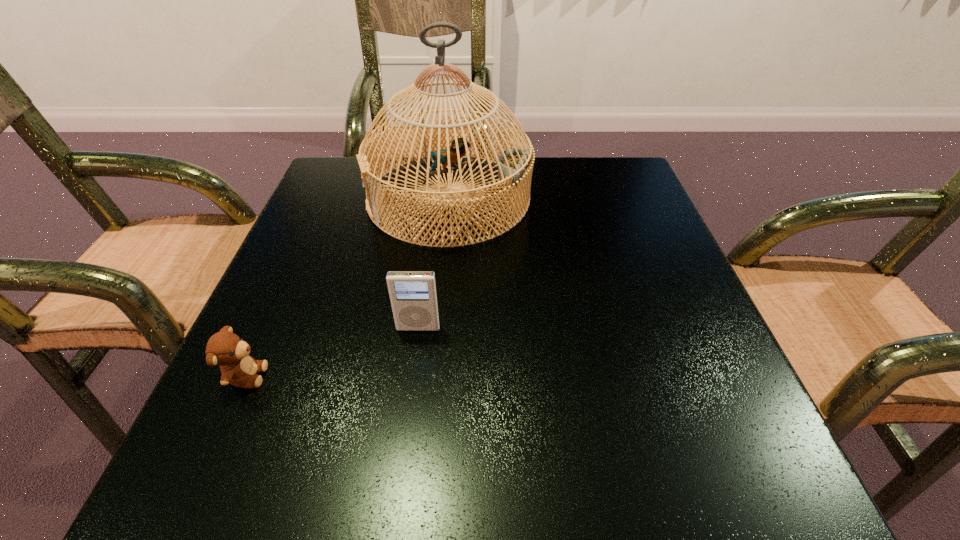
Locate an element on the screen. This screenshot has height=540, width=960. birdcage that is positioned at the left edge is located at coordinates (515, 165).

Find the location of a particular element. teddy bear positioned at the left edge is located at coordinates (229, 351).

What are the coordinates of `object present at the far left corner` in the screenshot? It's located at (515, 165).

Find the location of a particular element. free space at the far edge is located at coordinates click(x=552, y=175).

In the image, there is a desktop. Where is `vacant space at the near edge`? This screenshot has width=960, height=540. vacant space at the near edge is located at coordinates (520, 453).

The height and width of the screenshot is (540, 960). In the image, there is a desktop. Identify the location of free space at the left edge. (251, 350).

The image size is (960, 540). In the image, there is a desktop. What are the coordinates of `free space at the right edge` in the screenshot? It's located at (639, 294).

At what (x,y) coordinates should I click in order to perform the action: click on free region at the far left corner. Please return your answer as a coordinate pair (x, y). Looking at the image, I should click on (331, 165).

Identify the location of vacant region at the near right corner of the desktop. (708, 461).

What are the coordinates of `free spot between the farthest object and the second farthest object` in the screenshot? It's located at (434, 263).